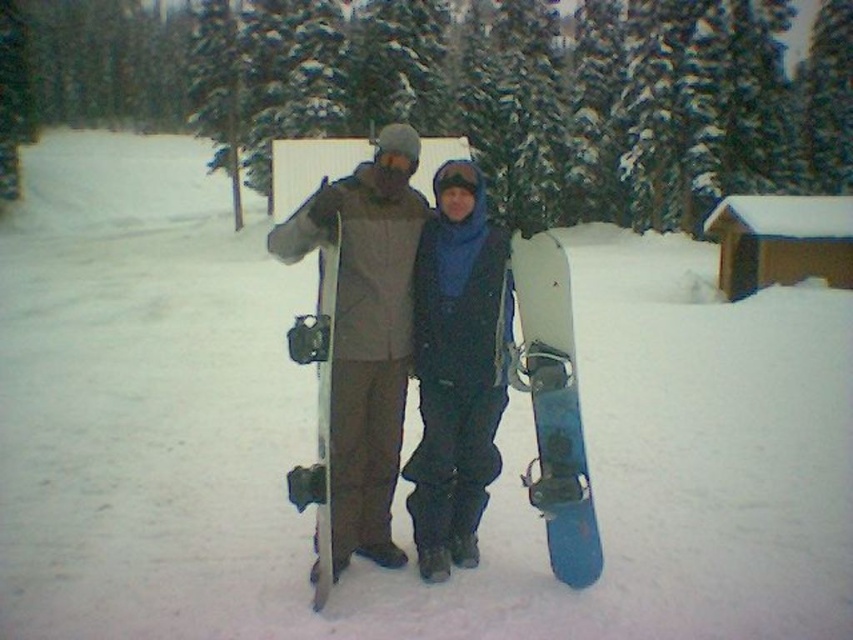
Can you confirm if blue matte snowboard at center is shorter than white matte snowboard at center?

Yes.

Does blue matte snowboard at center have a greater height compared to white matte snowboard at center?

In fact, blue matte snowboard at center may be shorter than white matte snowboard at center.

Between point (518, 301) and point (334, 268), which one is positioned in front?

Point (334, 268)

Locate an element on the screen. The width and height of the screenshot is (853, 640). blue matte snowboard at center is located at coordinates (553, 408).

Between point (368, 496) and point (561, 404), which one is positioned behind?

Point (368, 496)

Does matte gray snowboard at center appear on the left side of blue matte snowboard at center?

Indeed, matte gray snowboard at center is positioned on the left side of blue matte snowboard at center.

In order to click on matte gray snowboard at center in this screenshot , I will do `click(364, 333)`.

Is matte gray snowboard at center to the right of white matte snowboard at center from the viewer's perspective?

In fact, matte gray snowboard at center is to the left of white matte snowboard at center.

Which is in front, point (374, 259) or point (316, 586)?

Positioned in front is point (316, 586).

What do you see at coordinates (364, 333) in the screenshot? I see `matte gray snowboard at center` at bounding box center [364, 333].

Where is `matte gray snowboard at center`? The width and height of the screenshot is (853, 640). matte gray snowboard at center is located at coordinates (364, 333).